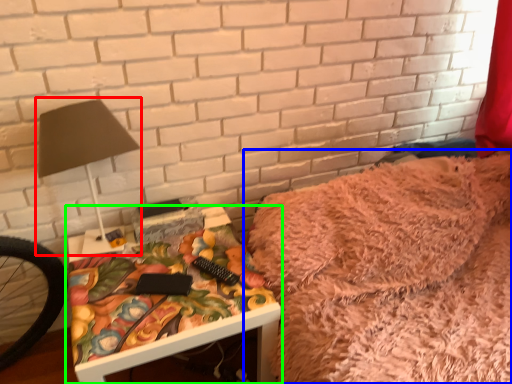
Question: Based on their relative distances, which object is nearer to table lamp (highlighted by a red box)? Choose from furniture (highlighted by a blue box) and table (highlighted by a green box).

Choices:
 (A) furniture
 (B) table

Answer: (B)